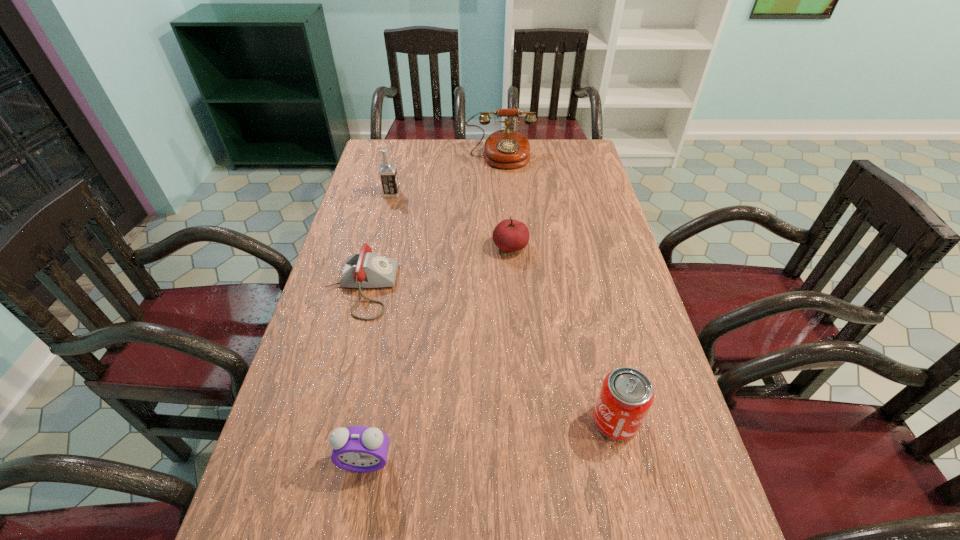
Where is `vacant region that satisfies the following two spatial constraints: 1. on the dial of the tomato; 2. on the right side of the taller telephone`? vacant region that satisfies the following two spatial constraints: 1. on the dial of the tomato; 2. on the right side of the taller telephone is located at coordinates (506, 247).